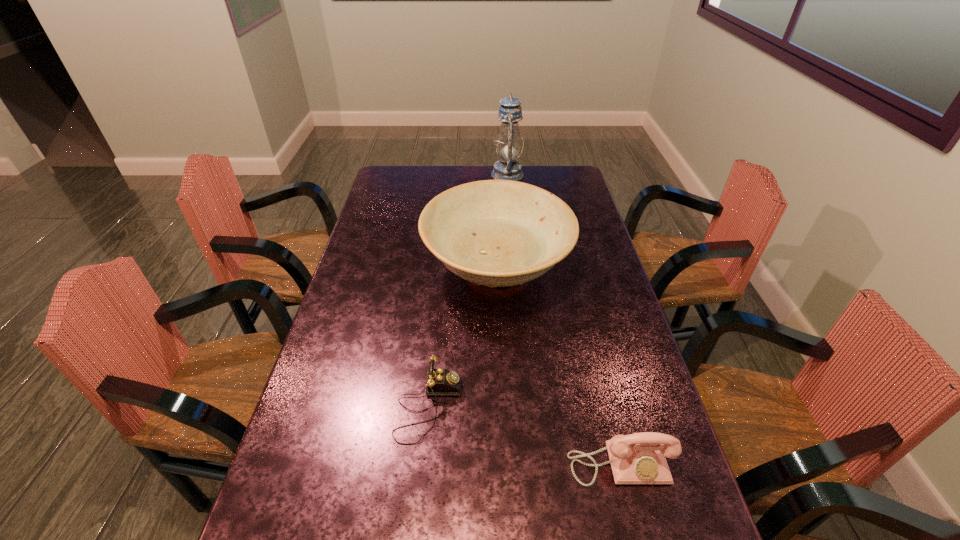
Locate an element on the screen. Image resolution: width=960 pixels, height=540 pixels. free space at the far left corner is located at coordinates (384, 180).

Find the location of a particular element. This screenshot has width=960, height=540. vacant space at the far right corner of the desktop is located at coordinates (576, 182).

Find the location of `free space between the shortest object and the second tallest object`. free space between the shortest object and the second tallest object is located at coordinates pyautogui.click(x=463, y=339).

Locate an element on the screen. free spot between the second shortest object and the shortest object is located at coordinates (524, 435).

Locate an element on the screen. free space between the lantern and the third tallest object is located at coordinates (564, 319).

Where is `vacant area between the tallest object and the right telephone`? The image size is (960, 540). vacant area between the tallest object and the right telephone is located at coordinates (564, 319).

The height and width of the screenshot is (540, 960). What are the coordinates of `free space between the farthest object and the shorter telephone` in the screenshot? It's located at (468, 291).

Locate an element on the screen. This screenshot has height=540, width=960. unoccupied area between the shorter telephone and the farthest object is located at coordinates (468, 291).

What are the coordinates of `object that stands as the closest to the right telephone` in the screenshot? It's located at (440, 382).

The image size is (960, 540). Identify the location of object that stands as the third closest to the tallest object. (639, 458).